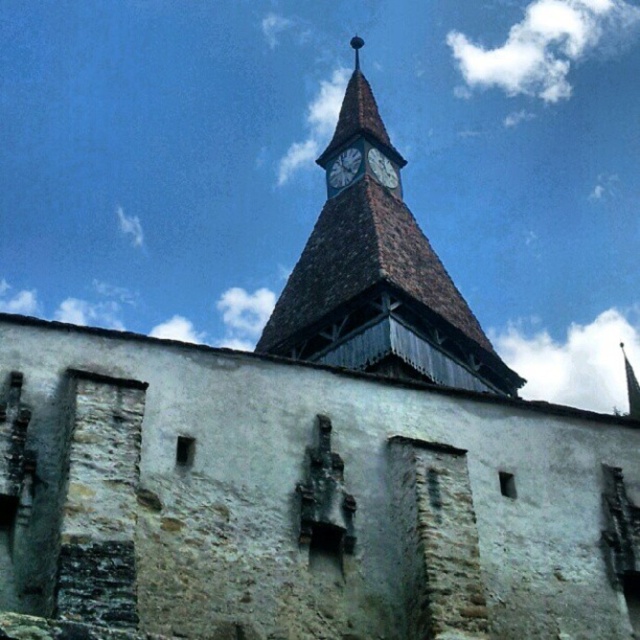
You are standing in front of the historic stone structure. There is a point marked at coordinates point [344,168]. Which object is this point located on?

The point [344,168] is located on the dark gray stone clock at upper center.

You are an architect examining the historic stone structure. You notice the brown wooden clock tower at upper center and the white stone clock at upper center. Which of these two objects is taller?

The brown wooden clock tower at upper center is taller than the white stone clock at upper center according to the description.